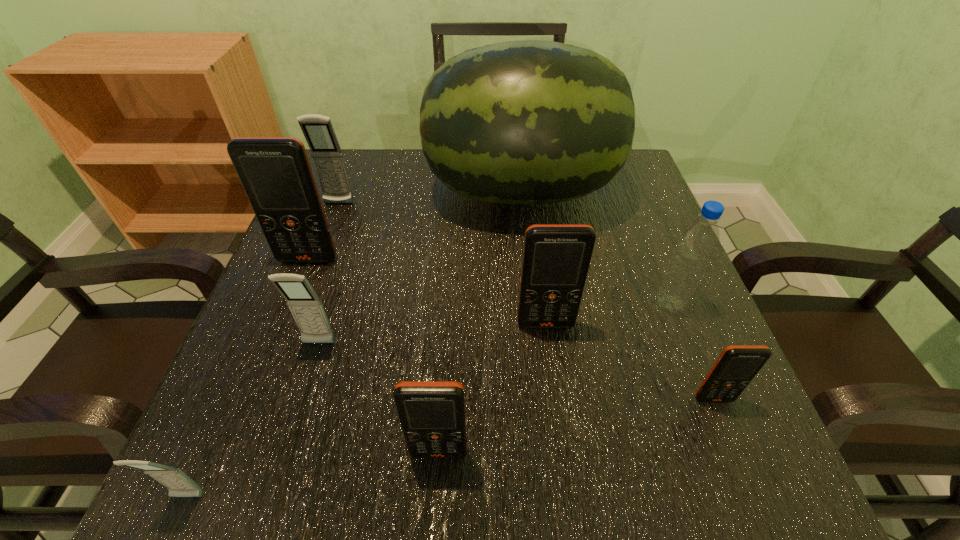
Where is `empty space between the farthest cellular telephone and the second orange cellular telephone from right to left`? empty space between the farthest cellular telephone and the second orange cellular telephone from right to left is located at coordinates (443, 265).

Image resolution: width=960 pixels, height=540 pixels. What are the coordinates of `free spot between the nearest orange cellular telephone and the green watermelon` in the screenshot? It's located at (480, 322).

You are a GUI agent. You are given a task and a screenshot of the screen. Output one action in this format:
    pyautogui.click(x=<x>, y=<y>)
    Task: Click on the free space between the second farthest gray cellular telephone and the fourth farthest object
    The image size is (960, 540).
    Given the screenshot: What is the action you would take?
    pyautogui.click(x=494, y=323)

Where is `free point between the nearest cellular telephone and the second biggest orange cellular telephone`? Image resolution: width=960 pixels, height=540 pixels. free point between the nearest cellular telephone and the second biggest orange cellular telephone is located at coordinates (367, 411).

At what (x,y) coordinates should I click in order to perform the action: click on free space between the farthest cellular telephone and the leftmost gray cellular telephone. Please return your answer as a coordinate pair (x, y). The width and height of the screenshot is (960, 540). Looking at the image, I should click on (263, 350).

Find the location of `blank region between the third smallest orange cellular telephone and the biggest gray cellular telephone`. blank region between the third smallest orange cellular telephone and the biggest gray cellular telephone is located at coordinates (443, 265).

The image size is (960, 540). In order to click on vacant area that lies between the nearest cellular telephone and the nearest orange cellular telephone in this screenshot , I will do `click(313, 475)`.

Locate an element on the screen. The width and height of the screenshot is (960, 540). object that is the closest to the water bottle is located at coordinates (x=526, y=122).

Find the location of `object that is the third closest to the farthest gray cellular telephone`. object that is the third closest to the farthest gray cellular telephone is located at coordinates (306, 307).

Identify which cellular telephone is the fifth nearest to the fourth farthest object. Please provide its 2D coordinates. Your answer should be formatted as a tuple, i.e. [(x, y)], where the tuple contains the x and y coordinates of a point satisfying the conditions above.

[(275, 172)]